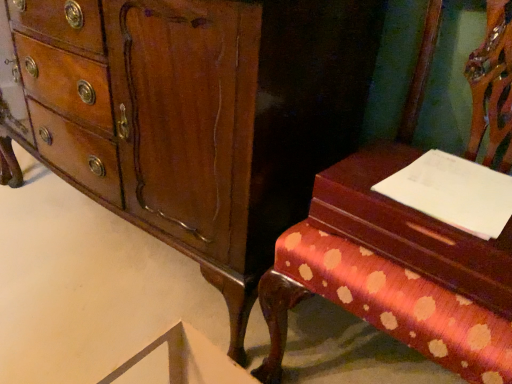
Question: Can you confirm if polka dot fabric bench at right is thinner than wooden vanity at right?

Choices:
 (A) yes
 (B) no

Answer: (B)

Question: Is polka dot fabric bench at right directly adjacent to wooden vanity at right?

Choices:
 (A) no
 (B) yes

Answer: (B)

Question: Is polka dot fabric bench at right outside of wooden vanity at right?

Choices:
 (A) no
 (B) yes

Answer: (B)

Question: Can you confirm if polka dot fabric bench at right is positioned to the right of wooden vanity at right?

Choices:
 (A) yes
 (B) no

Answer: (A)

Question: From a real-world perspective, is polka dot fabric bench at right on wooden vanity at right?

Choices:
 (A) yes
 (B) no

Answer: (B)

Question: From the image's perspective, would you say polka dot fabric bench at right is positioned over wooden vanity at right?

Choices:
 (A) no
 (B) yes

Answer: (A)

Question: Is wooden vanity at right positioned with its back to white paper at right?

Choices:
 (A) no
 (B) yes

Answer: (A)

Question: Can you confirm if wooden vanity at right is shorter than white paper at right?

Choices:
 (A) no
 (B) yes

Answer: (A)

Question: Does wooden vanity at right appear on the right side of white paper at right?

Choices:
 (A) yes
 (B) no

Answer: (B)

Question: Considering the relative sizes of wooden vanity at right and white paper at right in the image provided, is wooden vanity at right bigger than white paper at right?

Choices:
 (A) yes
 (B) no

Answer: (A)

Question: Considering the relative sizes of wooden vanity at right and white paper at right in the image provided, is wooden vanity at right smaller than white paper at right?

Choices:
 (A) no
 (B) yes

Answer: (A)

Question: Does wooden vanity at right have a greater width compared to white paper at right?

Choices:
 (A) no
 (B) yes

Answer: (B)

Question: Is mahogany wood chest of drawers at center behind polka dot fabric bench at right?

Choices:
 (A) no
 (B) yes

Answer: (B)